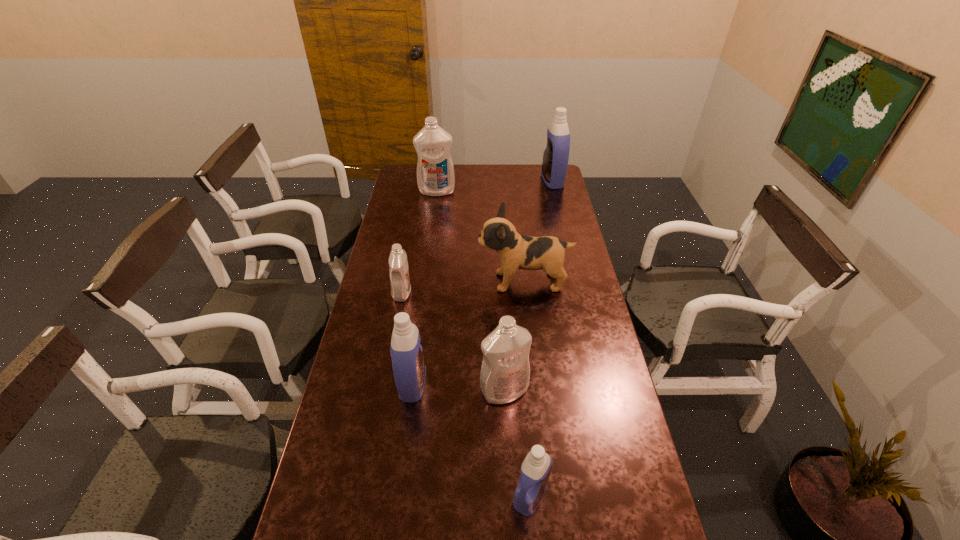
At what (x,y) coordinates should I click in order to perform the action: click on detergent that can be found as the closest to the puppy. Please return your answer as a coordinate pair (x, y). Looking at the image, I should click on (400, 284).

I want to click on the fourth closest detergent to the farthest blue detergent, so point(409,369).

Locate which white detergent ranks second in proximity to the biggest white detergent. Please provide its 2D coordinates. Your answer should be formatted as a tuple, i.e. [(x, y)], where the tuple contains the x and y coordinates of a point satisfying the conditions above.

[(505, 372)]

The image size is (960, 540). What are the coordinates of `white detergent that is the third nearest to the puppy` in the screenshot? It's located at (435, 172).

The image size is (960, 540). What are the coordinates of `blue detergent object that ranks as the second closest to the nearest detergent` in the screenshot? It's located at (556, 155).

Locate an element on the screen. The width and height of the screenshot is (960, 540). blue detergent object that ranks as the closest to the smallest blue detergent is located at coordinates (409, 369).